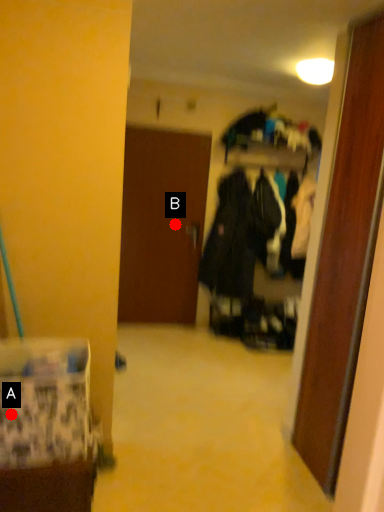
Question: Two points are circled on the image, labeled by A and B beside each circle. Which point is farther from the camera taking this photo?

Choices:
 (A) A is further
 (B) B is further

Answer: (B)